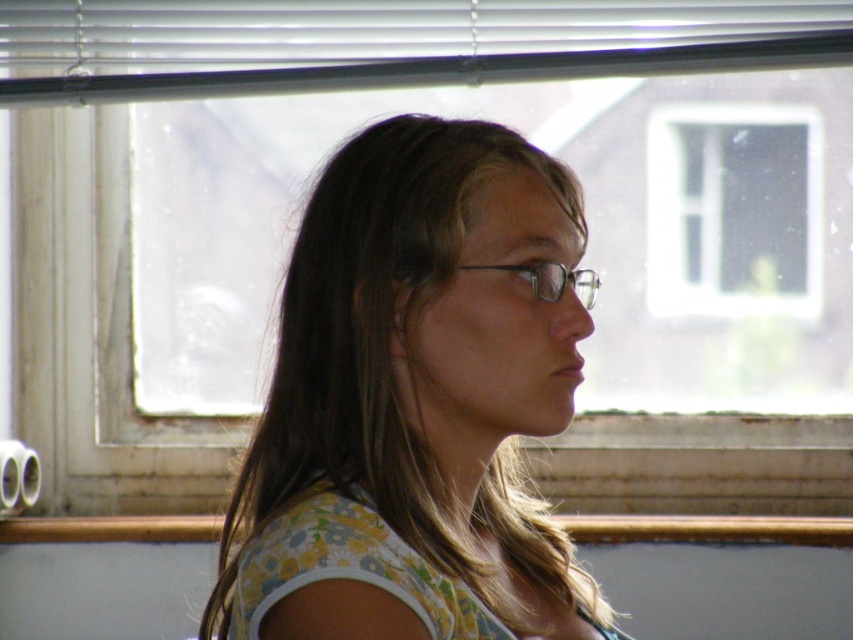
Question: Which object is the farthest from the clear plastic glasses at center?

Choices:
 (A) floral fabric shirt at center
 (B) white plastic blinds at upper center

Answer: (B)

Question: Which point is closer to the camera?

Choices:
 (A) (274, 35)
 (B) (347, 368)
 (C) (531, 285)

Answer: (C)

Question: Can you confirm if white plastic blinds at upper center is positioned above transparent glass window at upper center?

Choices:
 (A) no
 (B) yes

Answer: (B)

Question: Can you confirm if floral fabric shirt at center is positioned to the right of clear plastic glasses at center?

Choices:
 (A) yes
 (B) no

Answer: (B)

Question: Which point is farther to the camera?

Choices:
 (A) white plastic blinds at upper center
 (B) transparent glass window at upper center
 (C) clear plastic glasses at center
 (D) floral fabric shirt at center

Answer: (B)

Question: Does white plastic blinds at upper center have a smaller size compared to clear plastic glasses at center?

Choices:
 (A) no
 (B) yes

Answer: (A)